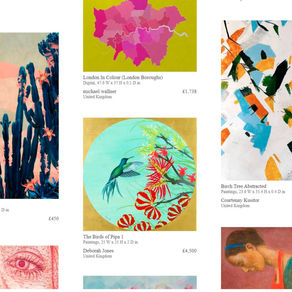
The height and width of the screenshot is (292, 292). Identify the location of artwork / painting. coord(250,272).